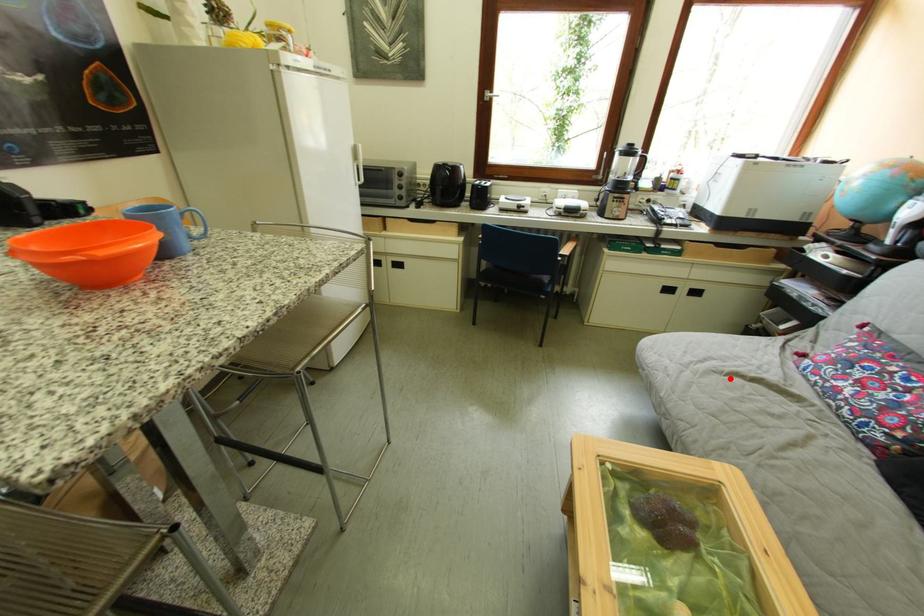
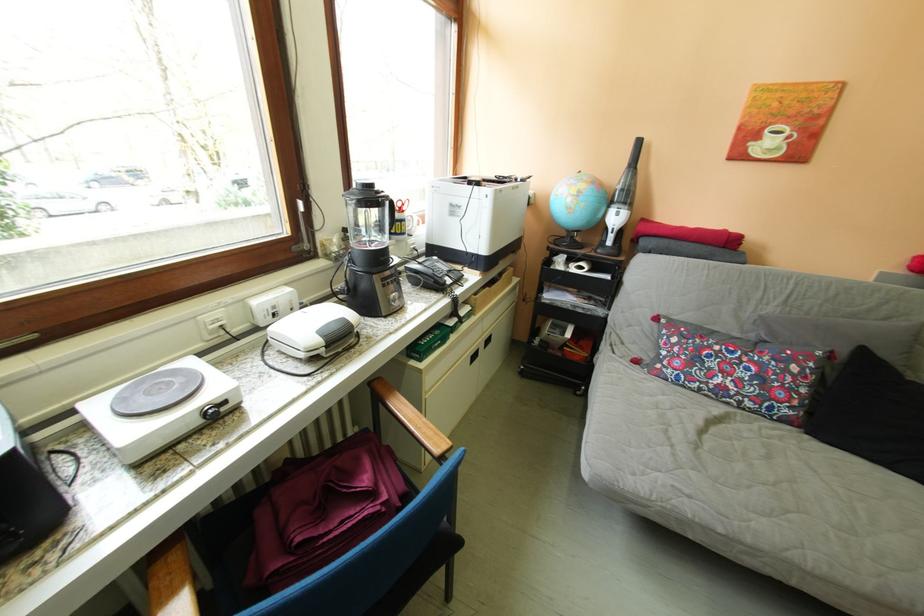
The point at the highlighted location is marked in the first image. Where is the corresponding point in the second image?

(713, 455)